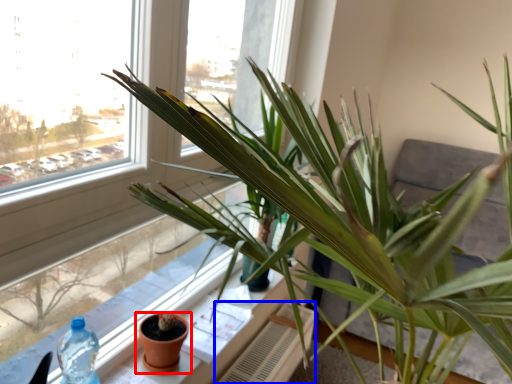
Question: Which object appears farthest to the camera in this image, flowerpot (highlighted by a red box) or radiator (highlighted by a blue box)?

Choices:
 (A) flowerpot
 (B) radiator

Answer: (B)